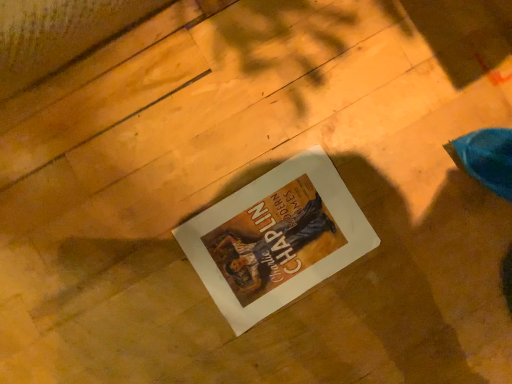
Identify the location of free space above matte paper poster at center (from a real-world perspective). (271, 248).